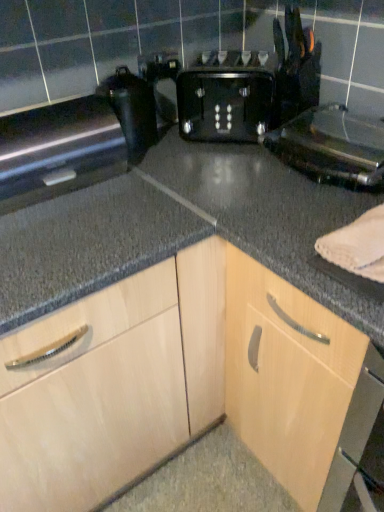
Question: Relative to black glossy coffee maker at upper left, which appears as the 2th appliance when viewed from the left, is black plastic toaster at center in front or behind?

Choices:
 (A) front
 (B) behind

Answer: (B)

Question: From the image's perspective, is black plastic toaster at center above or below black glossy coffee maker at upper left, placed as the second appliance when sorted from right to left?

Choices:
 (A) below
 (B) above

Answer: (B)

Question: Which object is positioned farthest from the black glossy coffee maker at upper left, which appears as the 2th appliance when viewed from the left?

Choices:
 (A) black plastic toaster at upper center, marked as the third appliance in a left-to-right arrangement
 (B) light wood cabinet at center
 (C) black plastic toaster at center
 (D) satin black oven at left, the third appliance from the right

Answer: (B)

Question: Which object is the farthest from the light wood cabinet at center?

Choices:
 (A) black plastic toaster at upper center, marked as the third appliance in a left-to-right arrangement
 (B) black plastic toaster at center
 (C) black glossy coffee maker at upper left, which appears as the 2th appliance when viewed from the left
 (D) satin black oven at left, the third appliance from the right

Answer: (C)